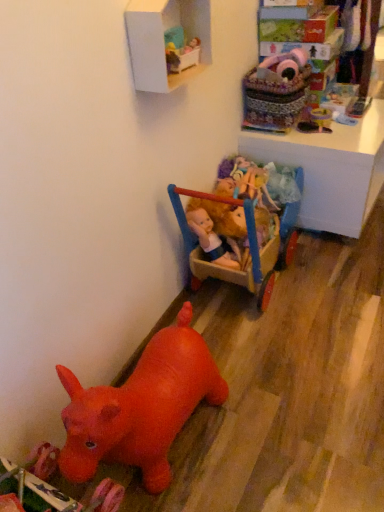
Question: From the image's perspective, is wooden doll carriage at upper right positioned above or below pink plush toy at upper right, the 5th toy from the bottom?

Choices:
 (A) below
 (B) above

Answer: (A)

Question: In terms of height, does wooden doll carriage at upper right look taller or shorter compared to pink plush toy at upper right, which is the 1th toy from top to bottom?

Choices:
 (A) short
 (B) tall

Answer: (B)

Question: Estimate the real-world distances between objects in this image. Which object is closer to the rubber red horse at lower left, acting as the 1th toy starting from the bottom?

Choices:
 (A) wooden doll carriage at upper right
 (B) plush fabric dolls at upper center, which is the 3th toy in bottom-to-top order
 (C) white matte shelf at upper center
 (D) velvet pink plush at upper right, which is the fourth toy from bottom to top
 (E) rubber red hippo at lower left, placed as the 4th toy when sorted from top to bottom

Answer: (E)

Question: Estimate the real-world distances between objects in this image. Which object is closer to the rubber red hippo at lower left, placed as the 4th toy when sorted from top to bottom?

Choices:
 (A) wooden doll carriage at upper right
 (B) rubber red horse at lower left, acting as the 1th toy starting from the bottom
 (C) plush fabric dolls at upper center, marked as the 3th toy in a top-to-bottom arrangement
 (D) velvet pink plush at upper right, which is the second toy in top-to-bottom order
 (E) white matte shelf at upper center

Answer: (B)